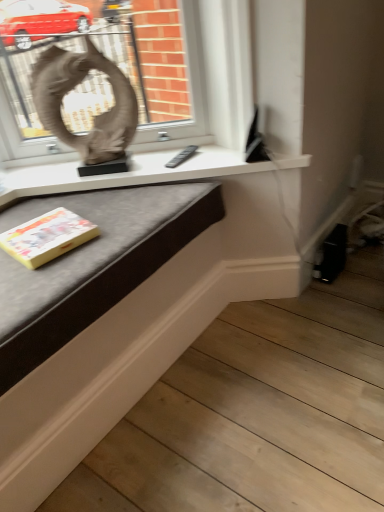
Locate an element on the screen. The image size is (384, 512). free space above yellow paper at lower left (from a real-world perspective) is located at coordinates (43, 233).